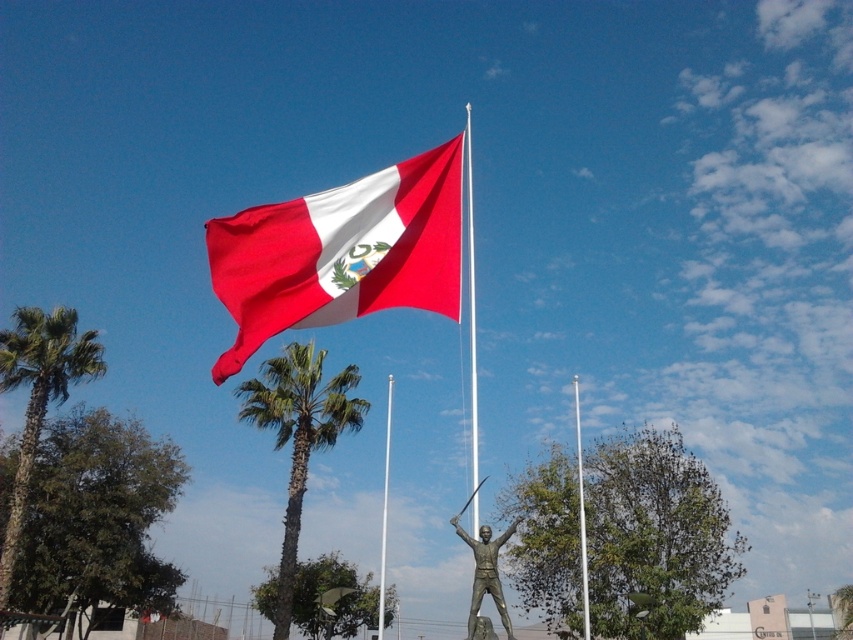
Question: From the image, what is the correct spatial relationship of matte fabric flag at upper center in relation to white glossy flag pole at center?

Choices:
 (A) left
 (B) right

Answer: (B)

Question: Which point appears farthest from the camera in this image?

Choices:
 (A) (474, 403)
 (B) (396, 184)
 (C) (38, 429)

Answer: (C)

Question: Can you confirm if polished bronze statue at center is positioned below polished metal flag pole at center?

Choices:
 (A) yes
 (B) no

Answer: (A)

Question: Is green leafy palm tree at center below polished bronze statue at center?

Choices:
 (A) no
 (B) yes

Answer: (B)

Question: Which point is farther to the camera?

Choices:
 (A) matte fabric flag at upper center
 (B) polished metal flag pole at center

Answer: (B)

Question: Estimate the real-world distances between objects in this image. Which object is farther from the matte fabric flag at upper center?

Choices:
 (A) green leafy palm tree at left
 (B) white glossy flag pole at center
 (C) metallic pole at center
 (D) green leafy palm tree at center

Answer: (B)